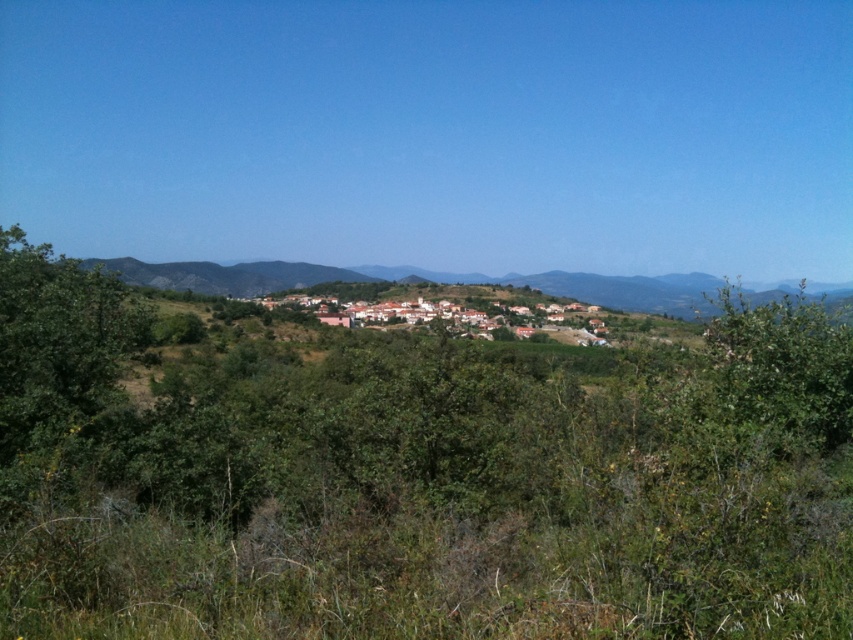
You are standing at the center of the image and want to walk to the green leafy bush at upper right. Is the green leafy tree at left in your path?

The green leafy tree at left is 12.51 meters away from the green leafy bush at upper right. Since you are walking towards the bush, the tree is not directly in your path unless you deviate from the straight line. Therefore, the green leafy tree at left is not blocking your path to the green leafy bush at upper right.

You are a hiker standing in the middle of the rural landscape and want to walk towards both the green leafy tree at left and the green leafy bush at upper right. Which one will you reach first?

You will reach the green leafy tree at left first because it is closer to you than the green leafy bush at upper right, which is further away.

You are a painter standing in the middle of the rural landscape scene. You want to paint the green leafy tree at left and the green leafy bush at upper right. Which object will require more paint to cover its width?

The green leafy bush at upper right will require more paint to cover its width because it is thicker than the green leafy tree at left.